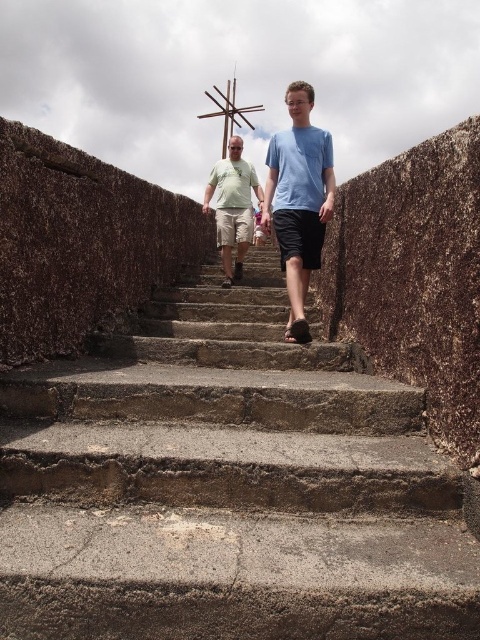
Can you confirm if concrete stairs at center is positioned to the right of light blue t-shirt at center?

In fact, concrete stairs at center is to the left of light blue t-shirt at center.

This screenshot has width=480, height=640. Find the location of `concrete stairs at center`. concrete stairs at center is located at coordinates (226, 486).

Between light blue t-shirt at center and wooden cross at center, which one has less height?

With less height is light blue t-shirt at center.

Is light blue t-shirt at center shorter than wooden cross at center?

Yes.

Describe the element at coordinates (299, 198) in the screenshot. I see `light blue t-shirt at center` at that location.

Where is `light blue t-shirt at center`? light blue t-shirt at center is located at coordinates (299, 198).

Is light blue t-shirt at center above matte green t-shirt at center?

Actually, light blue t-shirt at center is below matte green t-shirt at center.

Is the position of light blue t-shirt at center more distant than that of matte green t-shirt at center?

No, it is in front of matte green t-shirt at center.

Does point (265, 156) lie behind point (230, 141)?

Yes.

The height and width of the screenshot is (640, 480). In order to click on light blue t-shirt at center in this screenshot , I will do `click(299, 198)`.